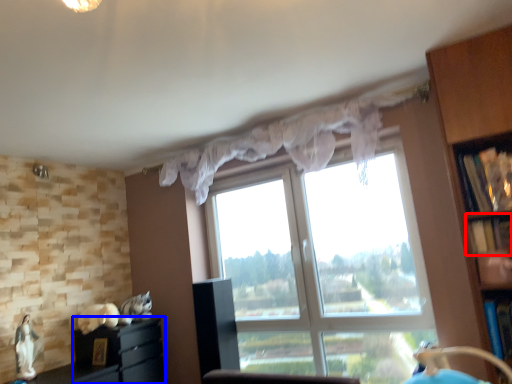
Question: Which of the following is the closest to the observer, shelf (highlighted by a red box) or cabinetry (highlighted by a blue box)?

Choices:
 (A) shelf
 (B) cabinetry

Answer: (A)